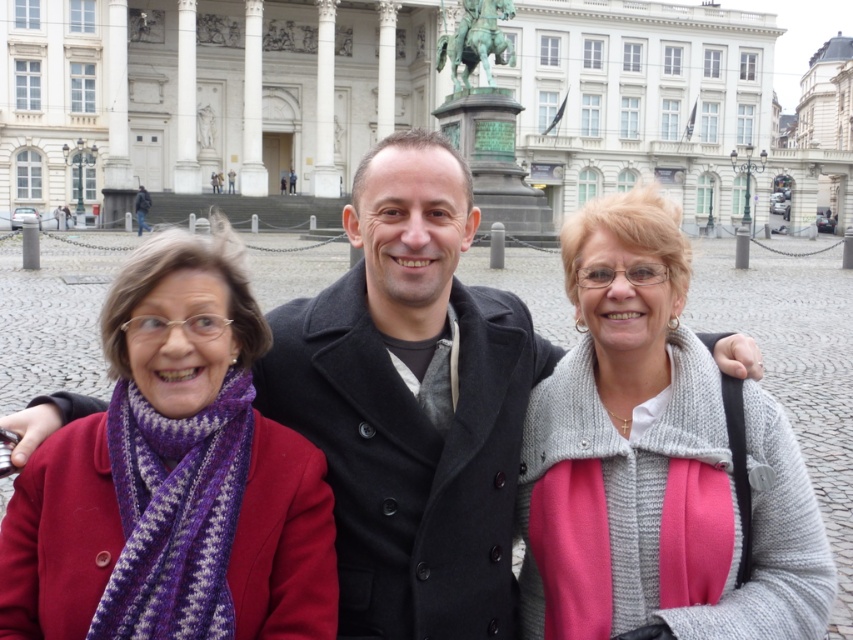
Question: Which of the following is the farthest from the observer?

Choices:
 (A) (798, 634)
 (B) (142, 209)

Answer: (B)

Question: Which point appears farthest from the camera in this image?

Choices:
 (A) (248, 504)
 (B) (582, 364)

Answer: (B)

Question: Is purple knitted scarf at center closer to the viewer compared to dark gray coat at center?

Choices:
 (A) yes
 (B) no

Answer: (A)

Question: Is purple knitted scarf at center thinner than dark gray coat at center?

Choices:
 (A) yes
 (B) no

Answer: (B)

Question: Which point is farther to the camera?

Choices:
 (A) (476, 4)
 (B) (566, 556)

Answer: (A)

Question: Does knitted gray sweater at center have a greater width compared to green patina bronze horseman at upper center?

Choices:
 (A) yes
 (B) no

Answer: (A)